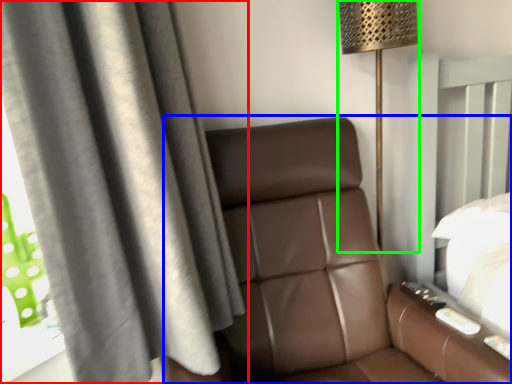
Question: Which object is the closest to the curtain (highlighted by a red box)? Choose among these: furniture (highlighted by a blue box) or lamp (highlighted by a green box).

Choices:
 (A) furniture
 (B) lamp

Answer: (A)